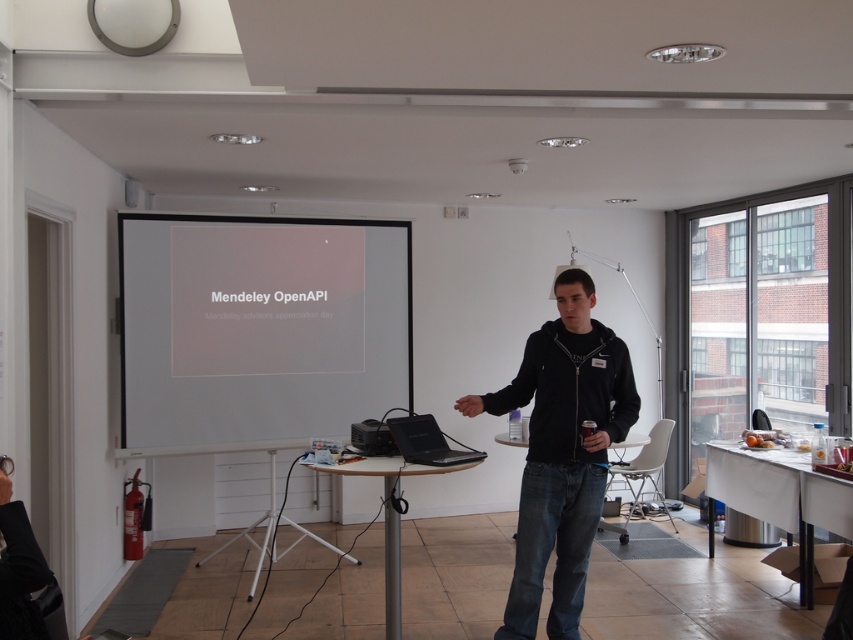
You are standing in the conference room and want to move towards the point at coordinates (289, 356). The fire extinguisher is on the left side of the room. If you walk straight ahead, will you reach the point before encountering the fire extinguisher?

The point at coordinates (289, 356) is 5.02 meters away from the camera. Since the fire extinguisher is on the left side of the room, walking straight ahead would not lead you to the fire extinguisher first. Therefore, you will reach the point before encountering the fire extinguisher.

You are attending a presentation in the conference room and notice two items at the center of the room. One is the black matte jacket at center and the other is the black plastic projector at center. Which item is positioned lower in the scene?

The black matte jacket at center is below the black plastic projector at center, so the black matte jacket at center is positioned lower in the scene.

From the picture: You are an attendee in the conference room and want to locate the presenter. Which object, the black matte jacket at center or the black plastic projector at center, is closer to the presenter who is facing the projection screen?

The black matte jacket at center is closer to the presenter who is facing the projection screen because it is positioned on the right side of the black plastic projector at center, which is likely between them.